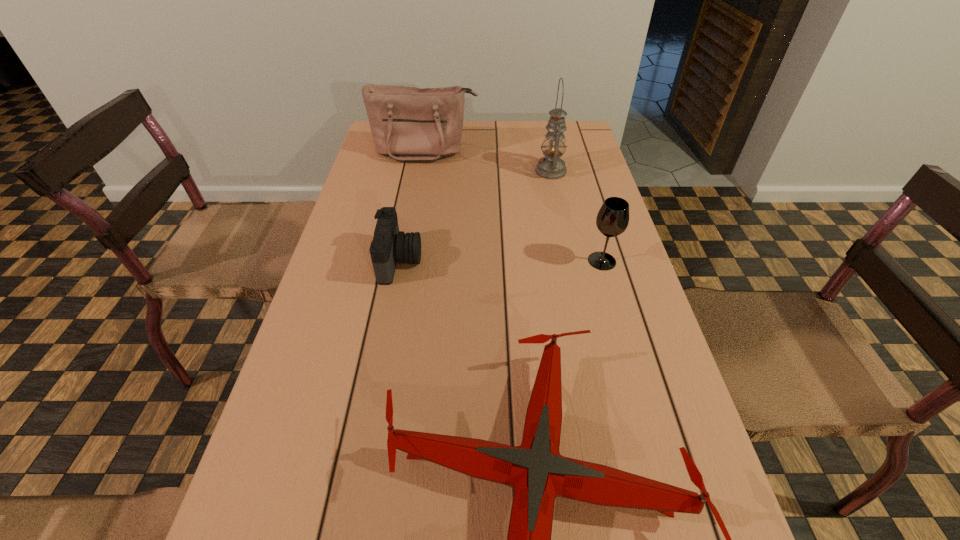
This screenshot has height=540, width=960. In order to click on free spot between the wineglass and the oil lamp in this screenshot , I will do `click(576, 216)`.

Locate an element on the screen. free space between the third shortest object and the camera is located at coordinates (501, 261).

Image resolution: width=960 pixels, height=540 pixels. I want to click on vacant region between the camera and the oil lamp, so click(475, 216).

Find the location of a particular element. the closest object to the third shortest object is located at coordinates (538, 473).

In order to click on the second closest object to the shortest object in this screenshot , I will do `click(612, 219)`.

You are a GUI agent. You are given a task and a screenshot of the screen. Output one action in this format:
    pyautogui.click(x=<x>, y=<y>)
    Task: Click on the free space that satisfies the following two spatial constraints: 1. on the front pocket of the third shortest object; 2. on the right side of the shoulder bag
    
    Given the screenshot: What is the action you would take?
    pyautogui.click(x=407, y=261)

Where is `vacant region that satisfies the following two spatial constraints: 1. at the lens of the camera; 2. on the left side of the wineglass`? The image size is (960, 540). vacant region that satisfies the following two spatial constraints: 1. at the lens of the camera; 2. on the left side of the wineglass is located at coordinates (399, 261).

At what (x,y) coordinates should I click in order to perform the action: click on blank area in the image that satisfies the following two spatial constraints: 1. at the lens of the wineglass; 2. on the right side of the camera. Please return your answer as a coordinate pair (x, y). This screenshot has height=540, width=960. Looking at the image, I should click on (399, 261).

Identify the location of vacant space that satisfies the following two spatial constraints: 1. on the front pocket of the fourth shortest object; 2. on the right side of the tallest object. (422, 171).

At what (x,y) coordinates should I click in order to perform the action: click on vacant area in the image that satisfies the following two spatial constraints: 1. on the front pocket of the wineglass; 2. on the right side of the shoulder bag. Please return your answer as a coordinate pair (x, y). The height and width of the screenshot is (540, 960). Looking at the image, I should click on (407, 261).